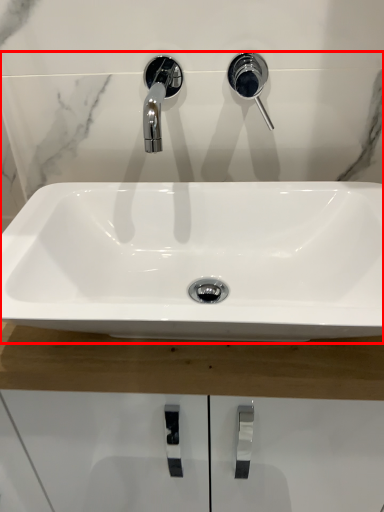
Question: From the image's perspective, where is sink (annotated by the red box) located in relation to plumbing fixture in the image?

Choices:
 (A) above
 (B) below

Answer: (B)